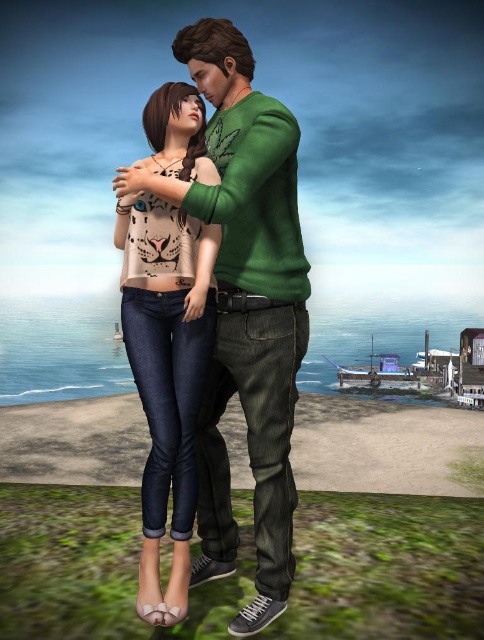
You are a photographer trying to capture a clear photo of the matte beige top at center and the matte green sweater at center. Since the two are overlapping, which one should you focus on to ensure the other remains visible in the background?

The matte beige top at center is behind the matte green sweater at center, so focusing on the matte green sweater at center will keep the matte beige top at center visible in the background.

You are a photographer trying to capture a portrait of the matte green sweater at center and the matte beige top at center. Which of the two should you focus on first if you want to ensure both are in frame without adjusting your camera angle?

The matte green sweater at center is not as tall as the matte beige top at center, so you should focus on the matte beige top at center first to ensure it stays within the frame while adjusting for the shorter matte green sweater at center.

You are a photographer planning to take a portrait of the two people in the image. You want to ensure that both the matte green sweater at center and the matte beige top at center are clearly visible in the photo. Given their sizes, which clothing item should you focus on first to ensure proper exposure?

The matte green sweater at center has a smaller size compared to matte beige top at center, so you should focus on the matte green sweater at center first to ensure its details are properly exposed since it is smaller and might require more attention to capture clearly.